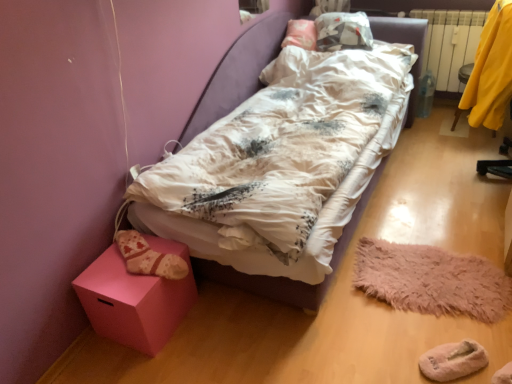
Question: From their relative heights in the image, would you say white plastic radiator at right is taller or shorter than knitted woolen sock at lower left?

Choices:
 (A) tall
 (B) short

Answer: (A)

Question: From a real-world perspective, is white plastic radiator at right physically located above or below knitted woolen sock at lower left?

Choices:
 (A) below
 (B) above

Answer: (B)

Question: Estimate the real-world distances between objects in this image. Which object is farther from the white plastic radiator at right?

Choices:
 (A) pink matte cube at lower left
 (B) white cotton bed at center
 (C) yellow fabric at right
 (D) knitted woolen sock at lower left
 (E) fuzzy pink mat at lower right

Answer: (A)

Question: Which is nearer to the pink matte cube at lower left?

Choices:
 (A) white plastic radiator at right
 (B) knitted woolen sock at lower left
 (C) white cotton bed at center
 (D) fuzzy pink mat at lower right
 (E) yellow fabric at right

Answer: (B)